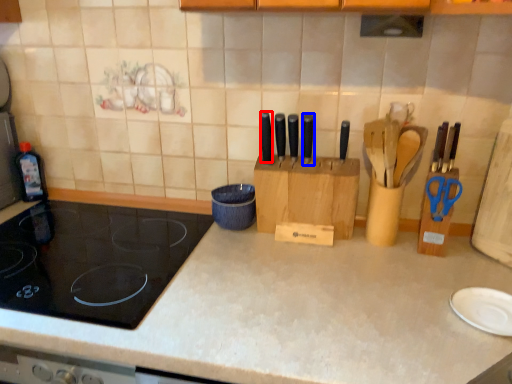
Question: Which object appears closest to the camera in this image, knife (highlighted by a red box) or knife (highlighted by a blue box)?

Choices:
 (A) knife
 (B) knife

Answer: (B)